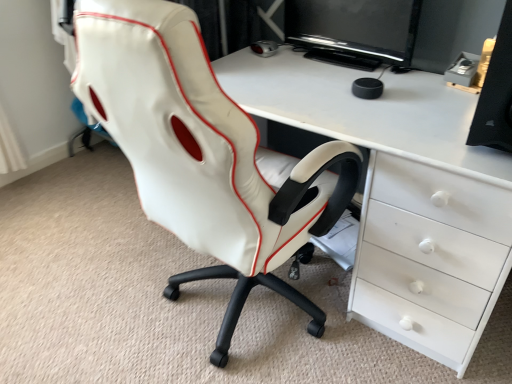
Locate an element on the screen. The image size is (512, 384). free space between black glossy monitor at upper center and black matte speaker at right is located at coordinates (402, 93).